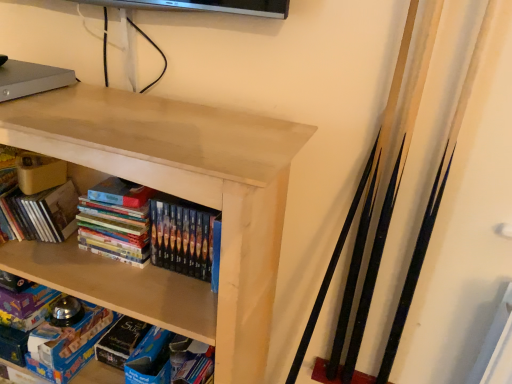
You are a GUI agent. You are given a task and a screenshot of the screen. Output one action in this format:
    pyautogui.click(x=<x>, y=<y>)
    Task: Click on the free location above matte wood shelf at upper center (from a real-world perspective)
    The height and width of the screenshot is (384, 512).
    Given the screenshot: What is the action you would take?
    pyautogui.click(x=121, y=109)